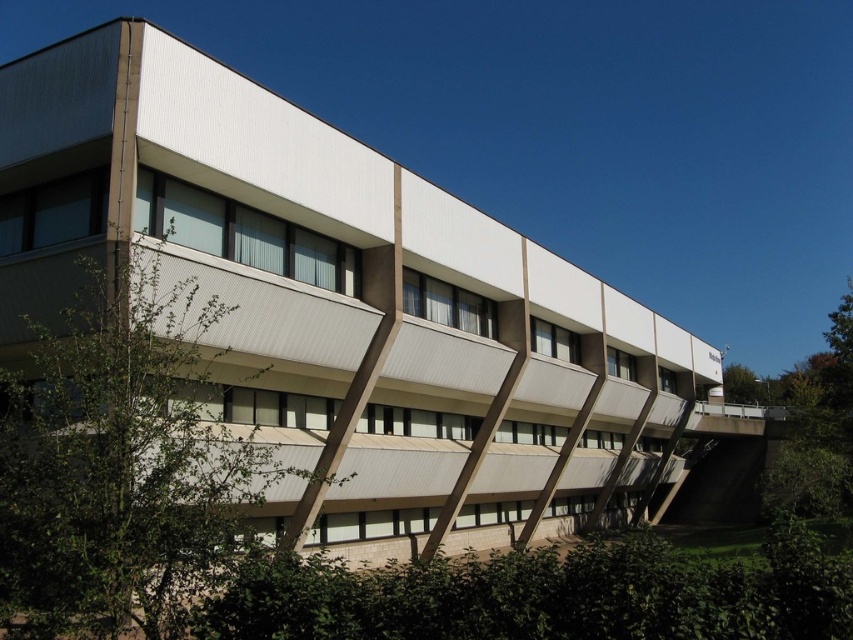
Question: Which point is farther from the camera taking this photo?

Choices:
 (A) (840, 492)
 (B) (125, 305)
 (C) (750, 403)

Answer: (C)

Question: Which point appears closest to the camera in this image?

Choices:
 (A) (216, 396)
 (B) (840, 417)
 (C) (747, 369)

Answer: (A)

Question: Which of these objects is positioned closest to the green leafy tree at right?

Choices:
 (A) green leafy tree at upper right
 (B) green leafy tree at center

Answer: (A)

Question: Can you confirm if green leafy tree at right is positioned below green leafy tree at upper right?

Choices:
 (A) no
 (B) yes

Answer: (A)

Question: Is green leafy tree at center wider than green leafy tree at upper right?

Choices:
 (A) yes
 (B) no

Answer: (B)

Question: Is green leafy tree at center further to camera compared to green leafy tree at right?

Choices:
 (A) no
 (B) yes

Answer: (A)